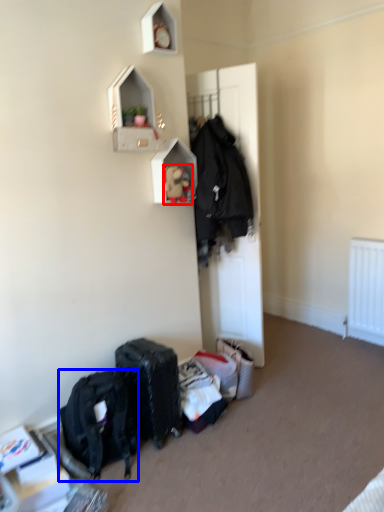
Question: Which of the following is the closest to the observer, toy (highlighted by a red box) or backpack (highlighted by a blue box)?

Choices:
 (A) toy
 (B) backpack

Answer: (B)